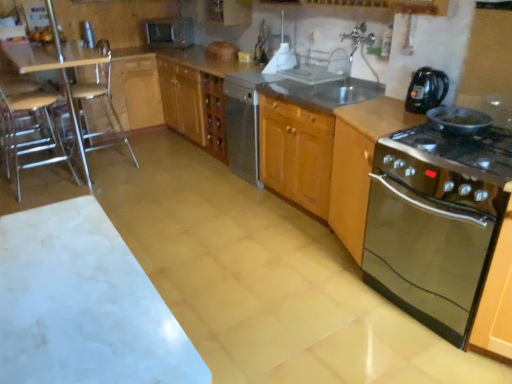
Locate an element on the screen. vacant space behind clear plastic bar stool at left, positioned as the 2th bar stool in left-to-right order is located at coordinates (131, 148).